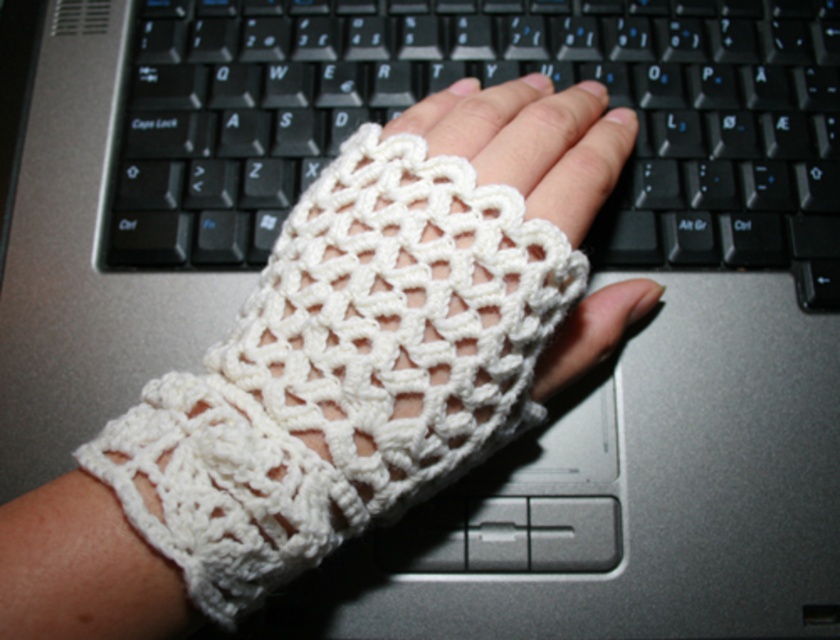
Can you confirm if black plastic keyboard at center is thinner than white crochet fingerless glove at center?

No, black plastic keyboard at center is not thinner than white crochet fingerless glove at center.

Which of these two, black plastic keyboard at center or white crochet fingerless glove at center, stands shorter?

Standing shorter between the two is white crochet fingerless glove at center.

Is point (794, 212) positioned after point (596, 346)?

Yes, point (794, 212) is farther from viewer.

This screenshot has height=640, width=840. Identify the location of black plastic keyboard at center. (487, 84).